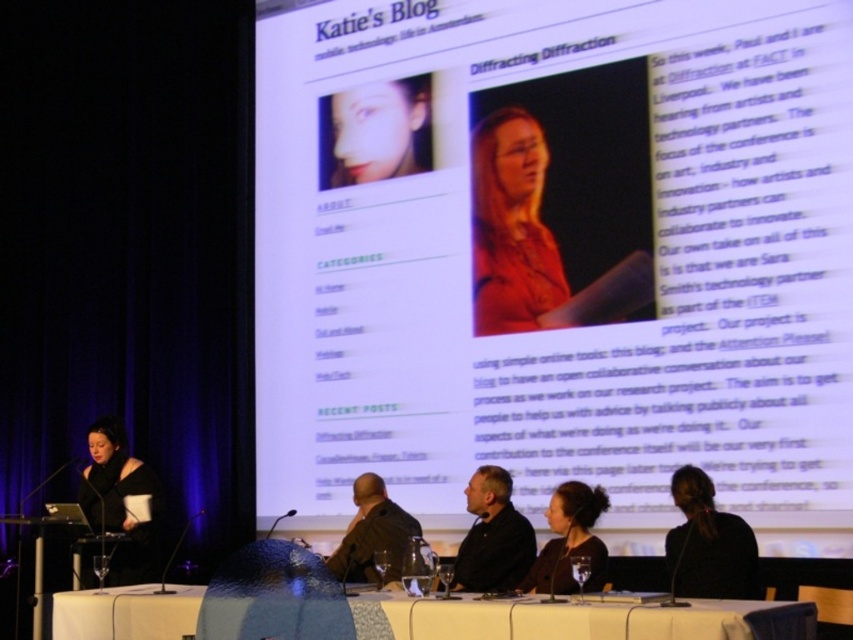
Can you confirm if dark brown hair at lower right is positioned to the right of dark brown hair at center?

Indeed, dark brown hair at lower right is positioned on the right side of dark brown hair at center.

Who is shorter, dark brown hair at lower right or dark brown hair at center?

Standing shorter between the two is dark brown hair at center.

Does point (675, 538) come behind point (595, 490)?

No.

The image size is (853, 640). I want to click on dark brown hair at lower right, so click(708, 544).

Is matte orange shirt at center positioned behind dark brown hair at center?

Yes.

Does matte orange shirt at center have a smaller size compared to dark brown hair at center?

Actually, matte orange shirt at center might be larger than dark brown hair at center.

The image size is (853, 640). I want to click on matte orange shirt at center, so click(514, 228).

Is smooth skin face at upper center to the right of dark brown leather jacket at center from the viewer's perspective?

Incorrect, smooth skin face at upper center is not on the right side of dark brown leather jacket at center.

Looking at this image, is the position of smooth skin face at upper center more distant than that of dark brown leather jacket at center?

Yes.

Who is more forward, (340, 106) or (379, 534)?

Point (379, 534) is more forward.

The image size is (853, 640). I want to click on smooth skin face at upper center, so click(x=375, y=131).